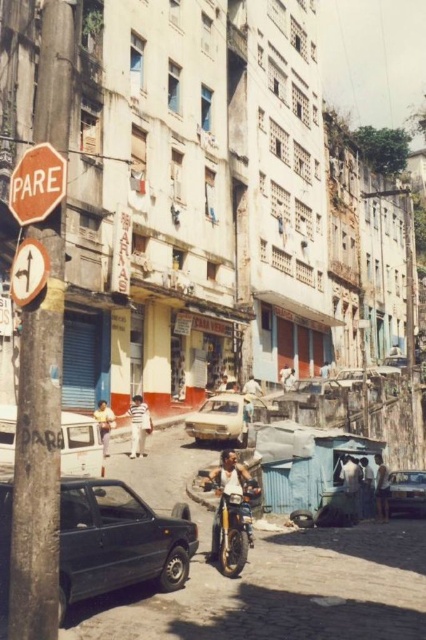
Looking at this image, you are standing on the street and see two points marked on the buildings. The first point is at coordinates point (134, 413) and the second is at point (377, 499). Which point is closer to you?

Point (134, 413) is further to the camera than point (377, 499), so the point closer to you is point (377, 499).

You are standing in front of the camera and see the white striped shirt at center. If you want to reach the shirt, how many steps would you need to take if each step is 2 feet long?

The white striped shirt at center is 100.64 feet away from the camera. If each step is 2 feet long, you would need to take approximately 50 steps to reach it.